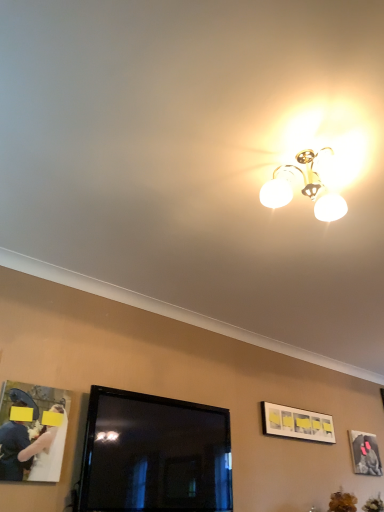
Question: From a real-world perspective, is matte black picture frame at upper right, which ranks as the 1th picture frame in bottom-to-top order, over white matte picture frame at upper right, placed as the first picture frame when sorted from front to back?

Choices:
 (A) no
 (B) yes

Answer: (A)

Question: Does matte black picture frame at upper right, which ranks as the 1th picture frame in bottom-to-top order, come behind white matte picture frame at upper right, placed as the first picture frame when sorted from front to back?

Choices:
 (A) yes
 (B) no

Answer: (A)

Question: From the image's perspective, would you say matte black picture frame at upper right, the 1th picture frame viewed from the back, is positioned over white matte picture frame at upper right, marked as the first picture frame in a top-to-bottom arrangement?

Choices:
 (A) no
 (B) yes

Answer: (A)

Question: From a real-world perspective, is matte black picture frame at upper right, marked as the second picture frame in a front-to-back arrangement, beneath white matte picture frame at upper right, positioned as the second picture frame in bottom-to-top order?

Choices:
 (A) no
 (B) yes

Answer: (B)

Question: Considering the relative sizes of matte black picture frame at upper right, which appears as the second picture frame when viewed from the left, and white matte picture frame at upper right, placed as the first picture frame when sorted from front to back, in the image provided, is matte black picture frame at upper right, which appears as the second picture frame when viewed from the left, smaller than white matte picture frame at upper right, placed as the first picture frame when sorted from front to back,?

Choices:
 (A) yes
 (B) no

Answer: (A)

Question: From the image's perspective, does matte black picture frame at upper right, which ranks as the 1th picture frame in bottom-to-top order, appear lower than white matte picture frame at upper right, positioned as the second picture frame in bottom-to-top order?

Choices:
 (A) yes
 (B) no

Answer: (A)

Question: Is white matte picture frame at upper right, marked as the first picture frame in a top-to-bottom arrangement, far from matte black picture frame at upper right, the 1th picture frame viewed from the back?

Choices:
 (A) yes
 (B) no

Answer: (B)

Question: Does white matte picture frame at upper right, marked as the first picture frame in a top-to-bottom arrangement, contain matte black picture frame at upper right, marked as the second picture frame in a front-to-back arrangement?

Choices:
 (A) no
 (B) yes

Answer: (A)

Question: Considering the relative sizes of white matte picture frame at upper right, placed as the first picture frame when sorted from front to back, and matte black picture frame at upper right, the first picture frame in the right-to-left sequence, in the image provided, is white matte picture frame at upper right, placed as the first picture frame when sorted from front to back, bigger than matte black picture frame at upper right, the first picture frame in the right-to-left sequence,?

Choices:
 (A) yes
 (B) no

Answer: (A)

Question: Is the position of white matte picture frame at upper right, the 1th picture frame viewed from the left, less distant than that of matte black picture frame at upper right, marked as the second picture frame in a front-to-back arrangement?

Choices:
 (A) no
 (B) yes

Answer: (B)

Question: Is white matte picture frame at upper right, the second picture frame viewed from the right, turned away from matte black picture frame at upper right, which appears as the second picture frame when viewed from the left?

Choices:
 (A) yes
 (B) no

Answer: (B)

Question: Is white matte picture frame at upper right, positioned as the second picture frame in bottom-to-top order, not inside matte black picture frame at upper right, which appears as the second picture frame when viewed from the left?

Choices:
 (A) no
 (B) yes

Answer: (B)

Question: Is white matte picture frame at upper right, the 2th picture frame from the back, placed right next to white satin dress at lower left?

Choices:
 (A) yes
 (B) no

Answer: (B)